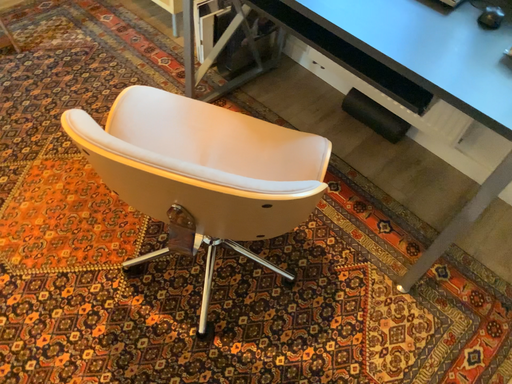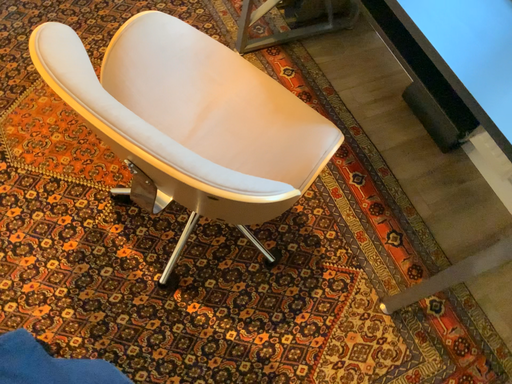
Question: How did the camera likely rotate when shooting the video?

Choices:
 (A) rotated upward
 (B) rotated downward

Answer: (B)